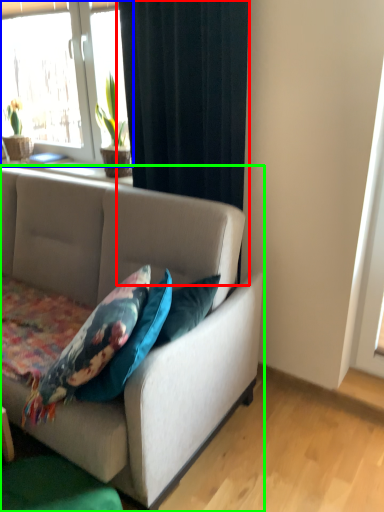
Question: Which is farther away from curtain (highlighted by a red box)? window (highlighted by a blue box) or studio couch (highlighted by a green box)?

Choices:
 (A) window
 (B) studio couch

Answer: (A)